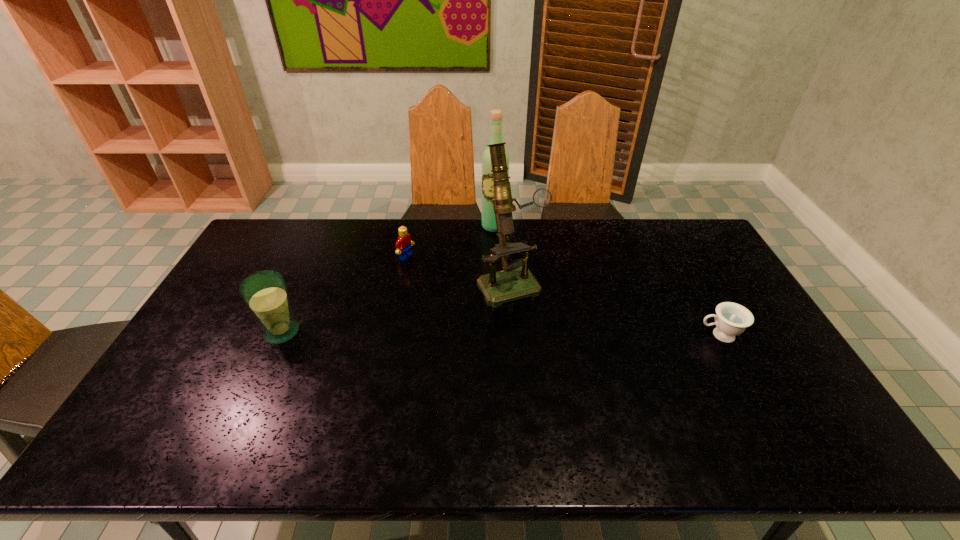
Where is `vacant space on the desktop that is between the leftmost object and the shortest object and is positioned on the front-facing side of the Lego`? The width and height of the screenshot is (960, 540). vacant space on the desktop that is between the leftmost object and the shortest object and is positioned on the front-facing side of the Lego is located at coordinates (551, 334).

Locate an element on the screen. This screenshot has height=540, width=960. free spot on the desktop that is between the third shortest object and the teacup and is positioned on the front-facing side of the wine bottle is located at coordinates (511, 334).

The image size is (960, 540). I want to click on free space on the desktop that is between the leftmost object and the shortest object and is positioned at the eyepiece of the microscope, so point(543,334).